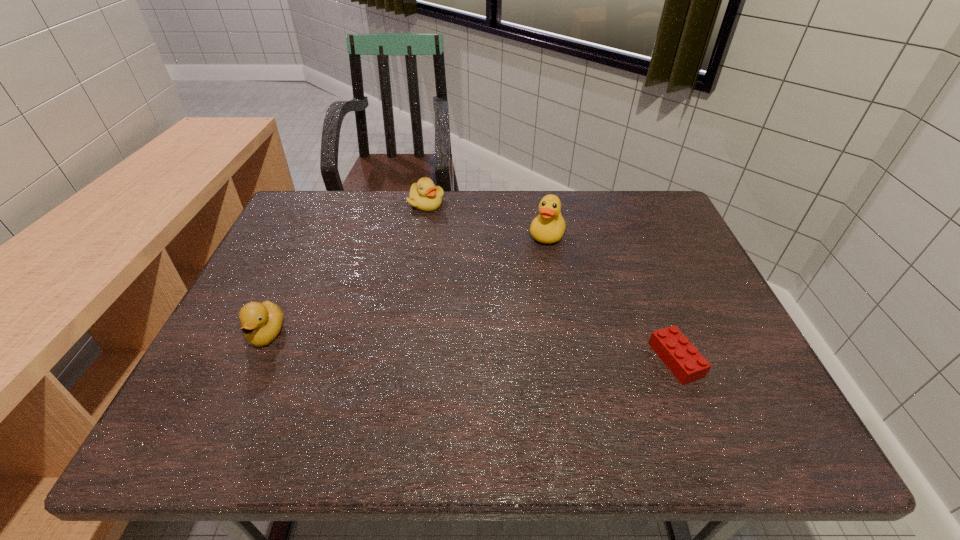
At what (x,y) coordinates should I click in order to perform the action: click on the leftmost object. Please return your answer as a coordinate pair (x, y). Image resolution: width=960 pixels, height=540 pixels. Looking at the image, I should click on (261, 323).

This screenshot has width=960, height=540. In order to click on the nearer duckling in this screenshot , I will do `click(261, 323)`.

This screenshot has height=540, width=960. I want to click on the shortest object, so click(x=682, y=358).

Identify the location of Lego. (682, 358).

At what (x,y) coordinates should I click in order to perform the action: click on the tallest object. Please return your answer as a coordinate pair (x, y). This screenshot has width=960, height=540. Looking at the image, I should click on (548, 227).

In order to click on duck in this screenshot , I will do `click(548, 227)`.

Locate an element on the screen. the farthest object is located at coordinates (424, 195).

At what (x,y) coordinates should I click in order to perform the action: click on the farther duckling. Please return your answer as a coordinate pair (x, y). Looking at the image, I should click on (424, 195).

In order to click on free space located on the face of the left duckling in this screenshot , I will do `click(246, 381)`.

At what (x,y) coordinates should I click in order to perform the action: click on vacant space located on the left of the rightmost object. Please return your answer as a coordinate pair (x, y). Image resolution: width=960 pixels, height=540 pixels. Looking at the image, I should click on (576, 360).